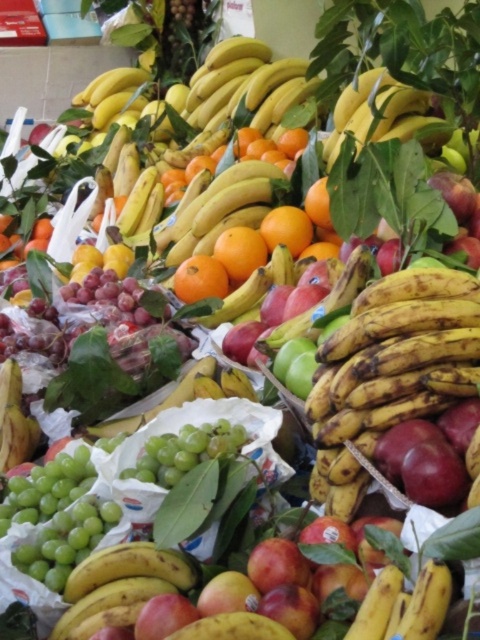
You are a customer trying to choose between two types of bananas at the market stall. The ripe yellow bananas at center and the yellow matte bananas at center are both available. If you want the wider banana, which one should you pick?

The yellow matte bananas at center are wider than the ripe yellow bananas at center, so you should pick the yellow matte bananas at center if you want the wider option.

You are a customer at the market stall looking for bananas. You see two groups of yellow matte bananas at lower left and yellow matte bananas at center. Which group is positioned lower in the pile?

The yellow matte bananas at lower left is positioned lower in the pile than the yellow matte bananas at center.